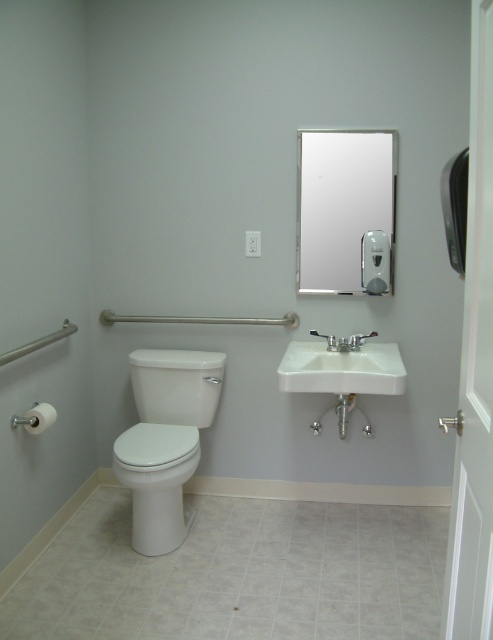
You are a home inspector checking the bathroom layout. You need to ensure that the clear glass mirror at upper center is properly installed above the white ceramic sink at center. According to the image, is the mirror positioned correctly?

Yes, the clear glass mirror at upper center is above the white ceramic sink at center, so it is positioned correctly.

You are standing in the bathroom and want to place a small plant between the two points marked as point (372,196) and point (318,390). Since you can only place the plant at one of these points, which point should you choose to ensure the plant is closer to the viewer?

You should place the plant at point (372,196) because it is further to the viewer than point (318,390).

In the scene shown: You are standing in the bathroom and want to wash your hands. The white ceramic sink at center is represented by point (342, 369). Where should you go?

You should go to the white ceramic sink at center located at point (342, 369) to wash your hands.